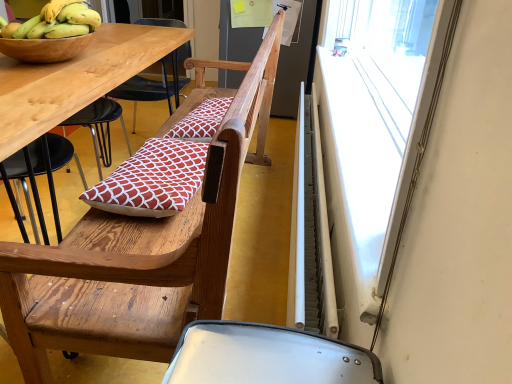
Locate an element on the screen. Image resolution: width=512 pixels, height=384 pixels. white plastic window screen at upper right is located at coordinates (383, 125).

Measure the distance between point (213,100) and camera.

The distance of point (213,100) from camera is 2.00 meters.

The image size is (512, 384). Describe the element at coordinates (152, 180) in the screenshot. I see `red printed cushion at center, acting as the first pillow starting from the front` at that location.

Locate an element on the screen. red printed cushion at center, the 2th pillow from the top is located at coordinates (152, 180).

Where is `white metallic radiator at right`? Image resolution: width=512 pixels, height=384 pixels. white metallic radiator at right is located at coordinates (310, 231).

The image size is (512, 384). Find the location of `white plastic window screen at upper right`. white plastic window screen at upper right is located at coordinates (383, 125).

Image resolution: width=512 pixels, height=384 pixels. In order to click on window screen that is on the right side of white metallic radiator at right in this screenshot , I will do `click(383, 125)`.

Looking at this image, is white metallic radiator at right not inside white plastic window screen at upper right?

Yes, white metallic radiator at right is outside of white plastic window screen at upper right.

From a real-world perspective, is white metallic radiator at right over white plastic window screen at upper right?

No, from a real-world perspective, white metallic radiator at right is not over white plastic window screen at upper right

Would you consider red printed cushion at center, the first pillow positioned from the bottom, to be distant from red printed fabric pillow at center, placed as the first pillow when sorted from top to bottom?

Actually, red printed cushion at center, the first pillow positioned from the bottom, and red printed fabric pillow at center, placed as the first pillow when sorted from top to bottom, are a little close together.

This screenshot has width=512, height=384. Identify the location of pillow that is in front of the red printed fabric pillow at center, placed as the first pillow when sorted from top to bottom. pyautogui.click(x=152, y=180).

Considering the points (201, 174) and (214, 122), which point is behind, point (201, 174) or point (214, 122)?

The point (214, 122) is farther.

In the scene shown: Is red printed cushion at center, acting as the first pillow starting from the front, to the right of red printed fabric pillow at center, marked as the second pillow in a bottom-to-top arrangement, from the viewer's perspective?

No.

Between white metallic radiator at right and red printed fabric pillow at center, marked as the second pillow in a bottom-to-top arrangement, which one is positioned in front?

white metallic radiator at right is more forward.

This screenshot has width=512, height=384. Identify the location of radiator on the right of the red printed fabric pillow at center, placed as the first pillow when sorted from top to bottom. (310, 231).

Does point (302, 260) appear closer or farther from the camera than point (205, 101)?

Point (302, 260) is closer to the camera than point (205, 101).

From the image's perspective, is red printed fabric pillow at center, which is the second pillow from front to back, under wooden chair at center?

Actually, red printed fabric pillow at center, which is the second pillow from front to back, appears above wooden chair at center in the image.

Is red printed fabric pillow at center, which is the second pillow from front to back, positioned with its back to wooden chair at center?

Yes, red printed fabric pillow at center, which is the second pillow from front to back, is positioned with its back facing wooden chair at center.

Can you tell me how much red printed fabric pillow at center, the 1th pillow when ordered from back to front, and wooden chair at center differ in facing direction?

red printed fabric pillow at center, the 1th pillow when ordered from back to front, and wooden chair at center are facing 4.32 degrees away from each other.

From a real-world perspective, is red printed fabric pillow at center, placed as the first pillow when sorted from top to bottom, under wooden chair at center?

No, from a real-world perspective, red printed fabric pillow at center, placed as the first pillow when sorted from top to bottom, is not under wooden chair at center.

Which point is more distant from viewer, (354, 259) or (72, 30)?

The point (72, 30) is more distant.

Between white plastic window screen at upper right and yellow bananas at upper left, which one has larger size?

white plastic window screen at upper right is bigger.

Locate an element on the screen. The width and height of the screenshot is (512, 384). banana above the white plastic window screen at upper right (from the image's perspective) is located at coordinates (57, 21).

Based on their positions, is white plastic window screen at upper right located to the left or right of yellow bananas at upper left?

white plastic window screen at upper right is positioned on yellow bananas at upper left's right side.

Considering the positions of points (57, 35) and (185, 164), is point (57, 35) closer to camera compared to point (185, 164)?

Yes.

Is yellow bananas at upper left aimed at red printed cushion at center, the first pillow positioned from the bottom?

No, yellow bananas at upper left is not facing towards red printed cushion at center, the first pillow positioned from the bottom.

How many degrees apart are the facing directions of yellow bananas at upper left and red printed cushion at center, arranged as the second pillow when viewed from the back?

yellow bananas at upper left and red printed cushion at center, arranged as the second pillow when viewed from the back, are facing 90 degrees away from each other.

Considering their positions, is yellow bananas at upper left located in front of or behind red printed cushion at center, the first pillow positioned from the bottom?

In the image, yellow bananas at upper left appears behind red printed cushion at center, the first pillow positioned from the bottom.

Is white plastic window screen at upper right in front of wooden chair at center?

Yes, the depth of white plastic window screen at upper right is less than that of wooden chair at center.

Is white plastic window screen at upper right bigger than wooden chair at center?

No, white plastic window screen at upper right is not bigger than wooden chair at center.

In order to click on chair below the white plastic window screen at upper right (from the image's perspective) in this screenshot , I will do `click(134, 262)`.

Is white plastic window screen at upper right aimed at wooden chair at center?

Yes, white plastic window screen at upper right is turned towards wooden chair at center.

You are a GUI agent. You are given a task and a screenshot of the screen. Output one action in this format:
    pyautogui.click(x=<x>, y=<y>)
    Task: Click on the window screen located on the right of white metallic radiator at right
    The image size is (512, 384).
    Given the screenshot: What is the action you would take?
    pyautogui.click(x=383, y=125)

You are a GUI agent. You are given a task and a screenshot of the screen. Output one action in this format:
    pyautogui.click(x=<x>, y=<y>)
    Task: Click on the pillow in front of the red printed fabric pillow at center, which is the second pillow from front to back
    
    Given the screenshot: What is the action you would take?
    pos(152,180)

When comparing their distances from wooden chair at center, does yellow bananas at upper left or white metallic radiator at right seem closer?

Among the two, white metallic radiator at right is located nearer to wooden chair at center.

When comparing their distances from white metallic radiator at right, does red printed cushion at center, the 2th pillow from the top, or red printed fabric pillow at center, the 1th pillow when ordered from back to front, seem further?

Based on the image, red printed fabric pillow at center, the 1th pillow when ordered from back to front, appears to be further to white metallic radiator at right.

Estimate the real-world distances between objects in this image. Which object is closer to red printed fabric pillow at center, the 1th pillow when ordered from back to front, red printed cushion at center, arranged as the second pillow when viewed from the back, or white metallic radiator at right?

Among the two, red printed cushion at center, arranged as the second pillow when viewed from the back, is located nearer to red printed fabric pillow at center, the 1th pillow when ordered from back to front.

Looking at the image, which one is located further to white plastic window screen at upper right, wooden chair at center or red printed cushion at center, the 2th pillow from the top?

red printed cushion at center, the 2th pillow from the top, is positioned further to the anchor white plastic window screen at upper right.

From the image, which object appears to be farther from yellow bananas at upper left, white plastic window screen at upper right or red printed cushion at center, arranged as the second pillow when viewed from the back?

white plastic window screen at upper right is positioned further to the anchor yellow bananas at upper left.

Looking at the image, which one is located closer to yellow bananas at upper left, white plastic window screen at upper right or wooden chair at center?

Among the two, wooden chair at center is located nearer to yellow bananas at upper left.

Estimate the real-world distances between objects in this image. Which object is further from red printed fabric pillow at center, placed as the first pillow when sorted from top to bottom, red printed cushion at center, the 2th pillow from the top, or wooden chair at center?

wooden chair at center is positioned further to the anchor red printed fabric pillow at center, placed as the first pillow when sorted from top to bottom.

Estimate the real-world distances between objects in this image. Which object is further from white plastic window screen at upper right, white metallic radiator at right or red printed fabric pillow at center, the 1th pillow when ordered from back to front?

Based on the image, red printed fabric pillow at center, the 1th pillow when ordered from back to front, appears to be further to white plastic window screen at upper right.

The width and height of the screenshot is (512, 384). In order to click on pillow positioned between wooden chair at center and red printed fabric pillow at center, the 1th pillow when ordered from back to front, from near to far in this screenshot , I will do `click(152, 180)`.

Image resolution: width=512 pixels, height=384 pixels. Find the location of `radiator between wooden chair at center and red printed fabric pillow at center, the 1th pillow when ordered from back to front, from front to back`. radiator between wooden chair at center and red printed fabric pillow at center, the 1th pillow when ordered from back to front, from front to back is located at coordinates (310, 231).

At what (x,y) coordinates should I click in order to perform the action: click on radiator situated between yellow bananas at upper left and white plastic window screen at upper right from left to right. Please return your answer as a coordinate pair (x, y). Looking at the image, I should click on (310, 231).

The image size is (512, 384). I want to click on radiator between wooden chair at center and red printed cushion at center, arranged as the second pillow when viewed from the back, from front to back, so click(x=310, y=231).